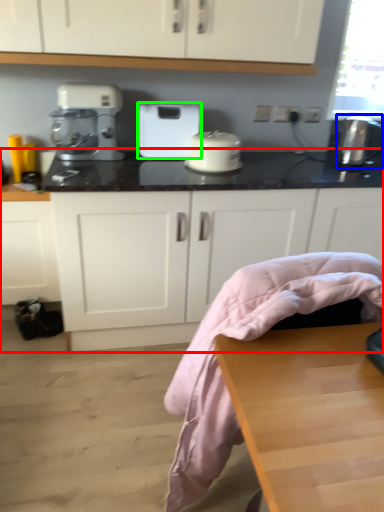
Question: Based on their relative distances, which object is farther from countertop (highlighted by a red box)? Choose from appliance (highlighted by a blue box) and home appliance (highlighted by a green box).

Choices:
 (A) appliance
 (B) home appliance

Answer: (A)